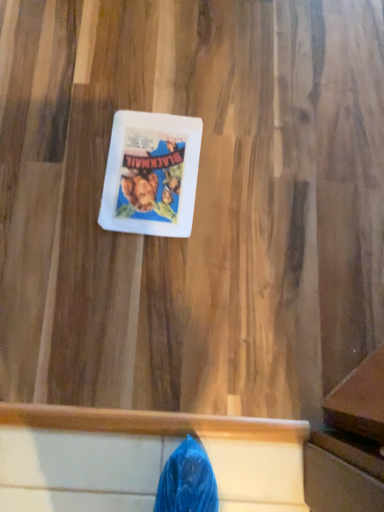
This screenshot has width=384, height=512. I want to click on vacant area that is in front of white matte comic book at center, so click(137, 278).